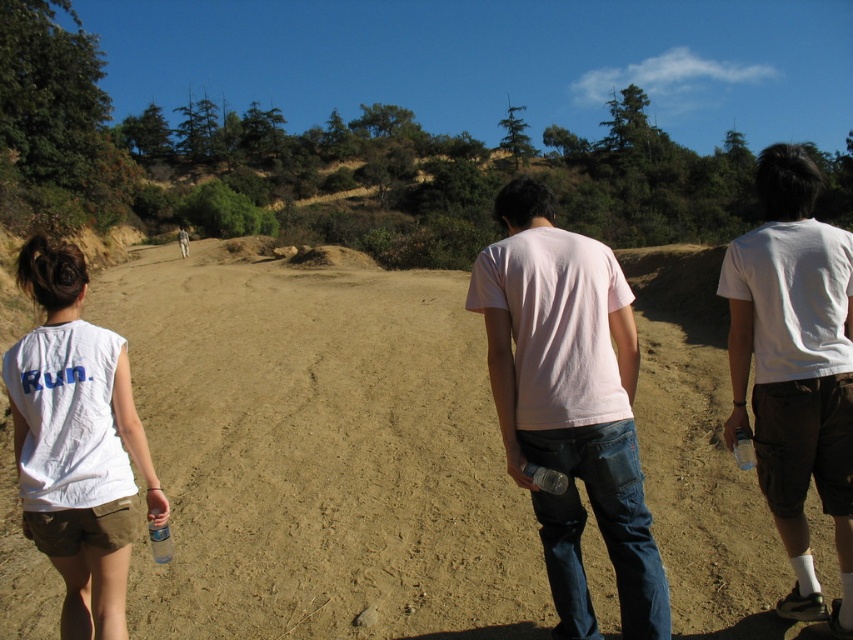
You are standing at the point marked by the coordinate point at (287, 326). You want to walk towards the woman in white sleeveless shirt with the word Run printed in blue on the back. Is the path between you and her wide enough for a 2.5 meter wide truck to pass through?

The path between you and the woman in white sleeveless shirt with the word Run printed in blue on the back is 12.43 meters wide, so yes, the truck can pass through since it is wider than the truck.

You are standing at the point marked by the coordinate point [320,452] in the image. What is the type of ground you are currently standing on?

The point [320,452] indicates brown sandy ground at center, so you are standing on brown sandy ground.